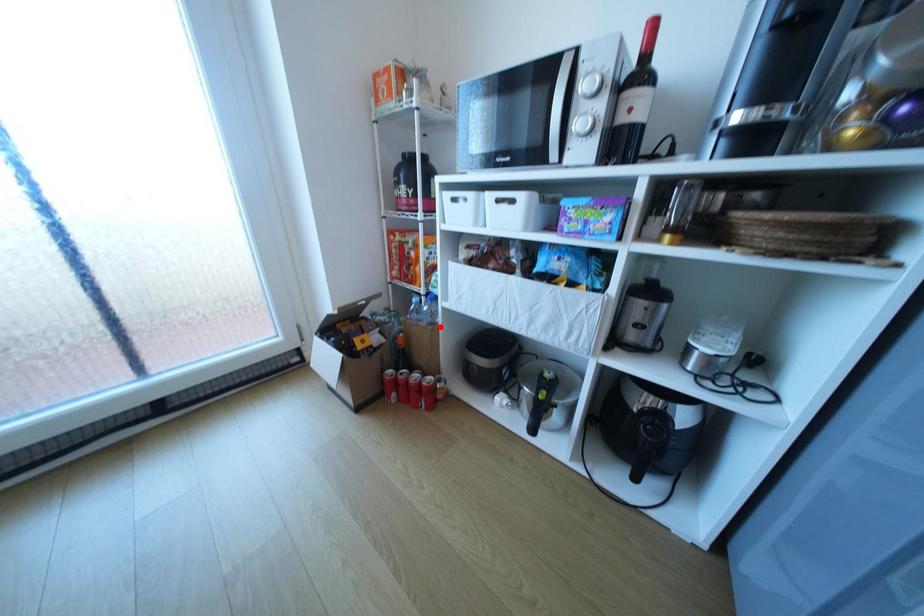
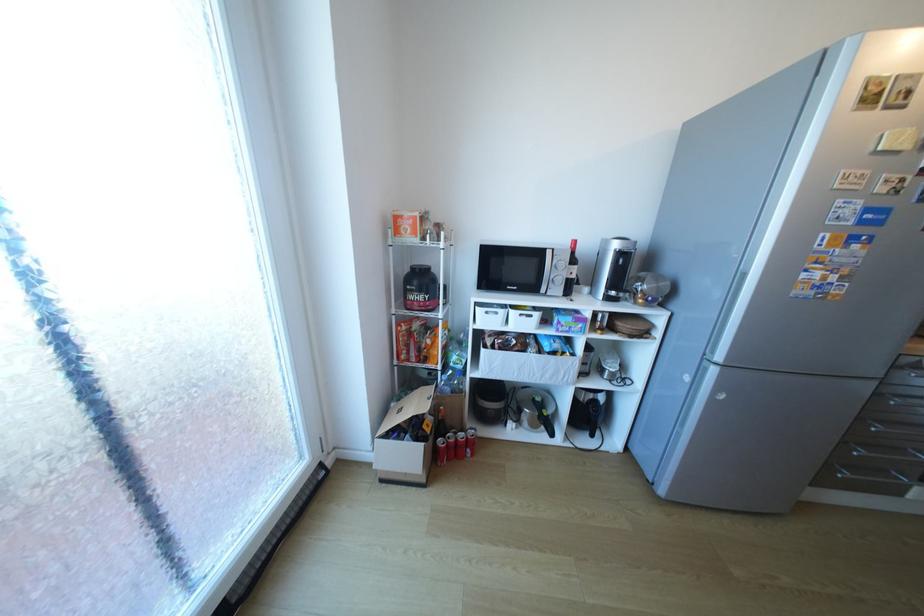
Find the pixel in the second image that matches the highlighted location in the first image.

(472, 394)